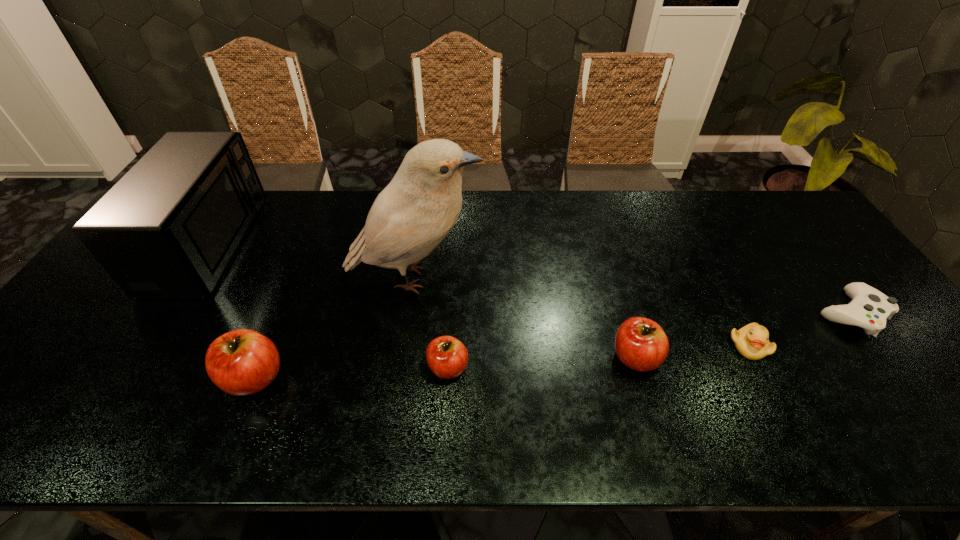
Where is `unoccupied position between the shortest apple and the tallest object`? This screenshot has height=540, width=960. unoccupied position between the shortest apple and the tallest object is located at coordinates (432, 323).

Identify the location of free area in between the microwave_oven and the sixth object from right to left. (231, 310).

This screenshot has width=960, height=540. I want to click on free spot between the fifth shortest object and the fifth tallest object, so click(351, 373).

The image size is (960, 540). I want to click on vacant area that lies between the third shortest object and the duckling, so click(x=598, y=356).

Identify the location of empty space between the rightmost object and the third tallest object. (552, 346).

Identify the location of free space between the sixth shortest object and the sixth object from right to left. (231, 310).

Locate which object ranks third in proximity to the second apple from left to right. Please provide its 2D coordinates. Your answer should be formatted as a tuple, i.e. [(x, y)], where the tuple contains the x and y coordinates of a point satisfying the conditions above.

[(641, 344)]

You are a GUI agent. You are given a task and a screenshot of the screen. Output one action in this format:
    pyautogui.click(x=<x>, y=<y>)
    Task: Click on the object that stands as the third closest to the shortest apple
    This screenshot has width=960, height=540.
    Given the screenshot: What is the action you would take?
    pyautogui.click(x=641, y=344)

Point out which apple is positioned as the second nearest to the control. Please provide its 2D coordinates. Your answer should be formatted as a tuple, i.e. [(x, y)], where the tuple contains the x and y coordinates of a point satisfying the conditions above.

[(447, 357)]

Identify the location of apple that stands as the second closest to the fifth object from left to right. (241, 362).